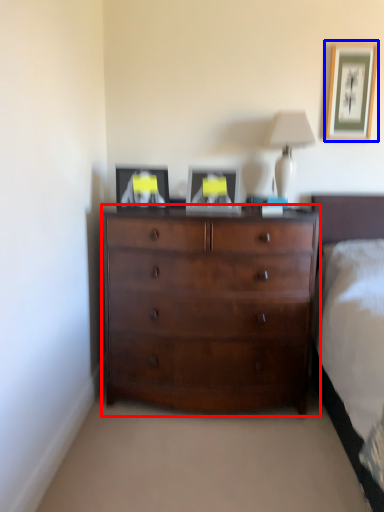
Question: Which object is further to the camera taking this photo, chest of drawers (highlighted by a red box) or picture frame (highlighted by a blue box)?

Choices:
 (A) chest of drawers
 (B) picture frame

Answer: (B)